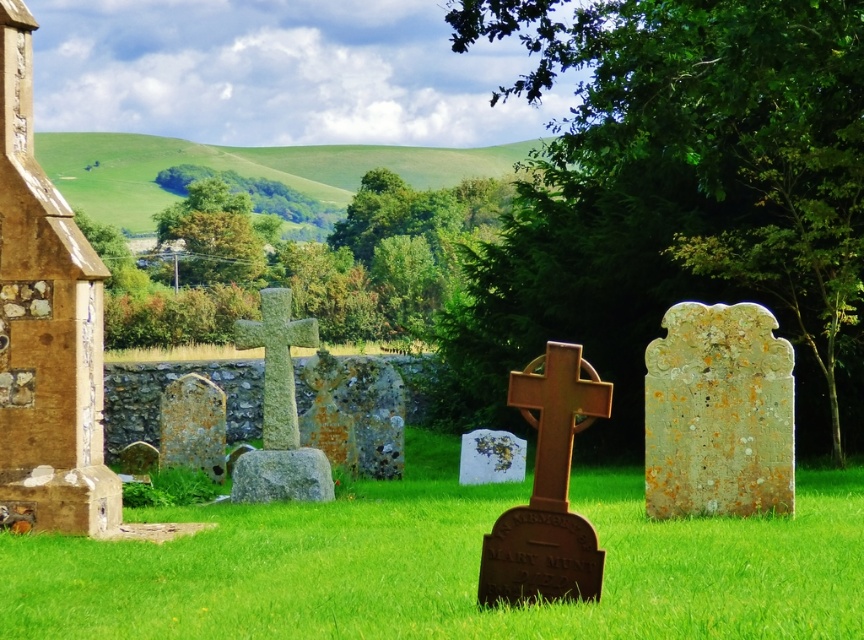
Question: Which point is farther to the camera?

Choices:
 (A) rustic wood cross at center
 (B) green grassy at center
 (C) speckled stone gravestone at center

Answer: (C)

Question: Which point is farther to the camera?

Choices:
 (A) (494, 448)
 (B) (701, 365)
 (C) (65, 467)
 (D) (269, 298)

Answer: (A)

Question: Is brown stone church at left positioned before speckled stone gravestone at center-left?

Choices:
 (A) yes
 (B) no

Answer: (A)

Question: Among these objects, which one is farthest from the camera?

Choices:
 (A) rustic wood cross at center
 (B) green stone cross at center
 (C) lichen-covered stone gravestone at center-right

Answer: (B)

Question: Observing the image, what is the correct spatial positioning of brown stone church at left in reference to gray stone gravestone at center?

Choices:
 (A) left
 (B) right

Answer: (A)

Question: Does brown stone church at left lie behind gray stone gravestone at center?

Choices:
 (A) yes
 (B) no

Answer: (B)